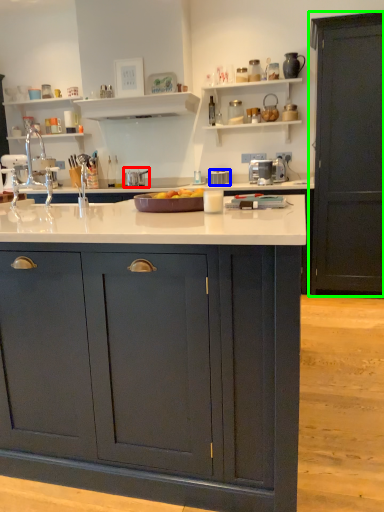
Question: Based on their relative distances, which object is farther from appliance (highlighted by a red box)? Choose from appliance (highlighted by a blue box) and cabinetry (highlighted by a green box).

Choices:
 (A) appliance
 (B) cabinetry

Answer: (B)